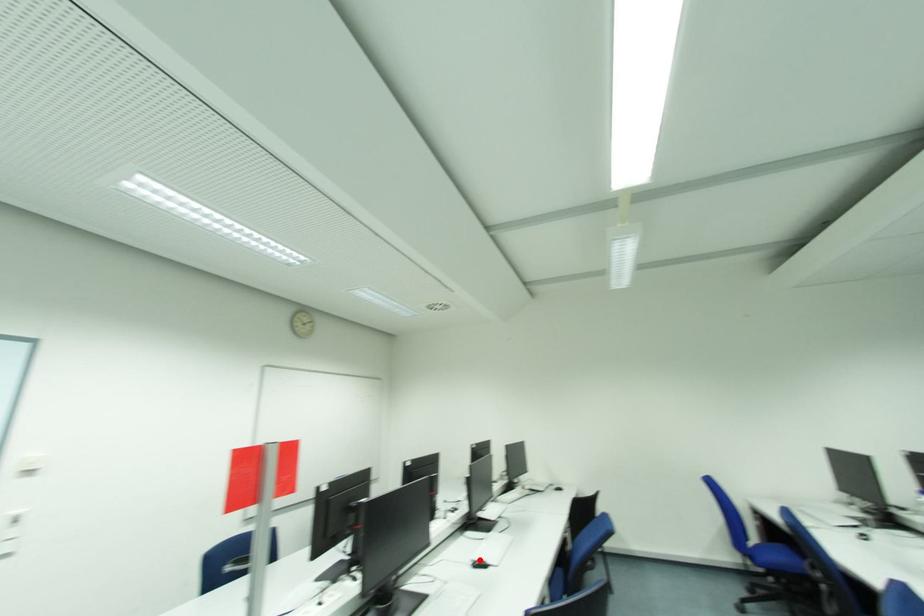
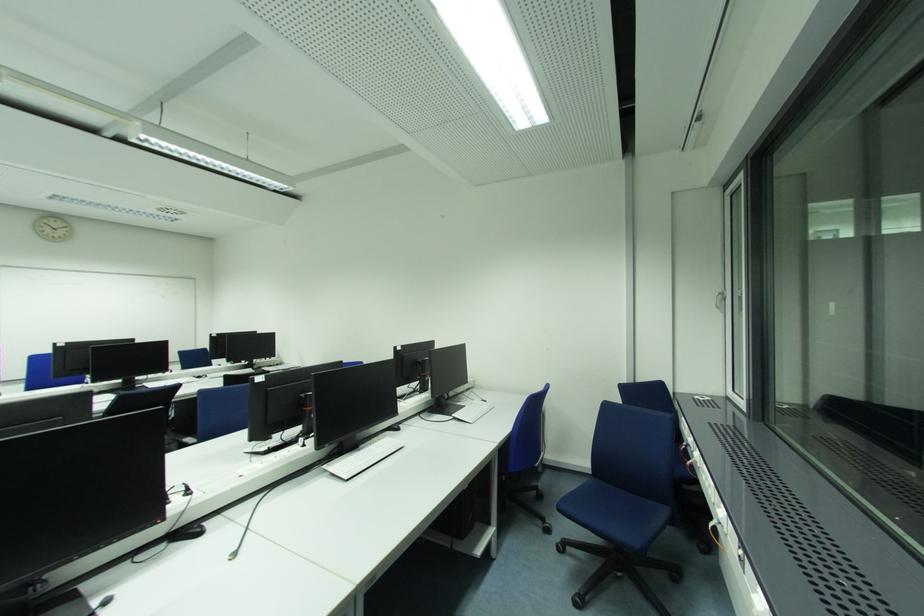
Question: I am providing you with two images of the same scene from different viewpoints. A red point is marked on the first image. At the location where the point appears in image 1, is it still visible in image 2?

Choices:
 (A) Yes
 (B) No

Answer: (B)